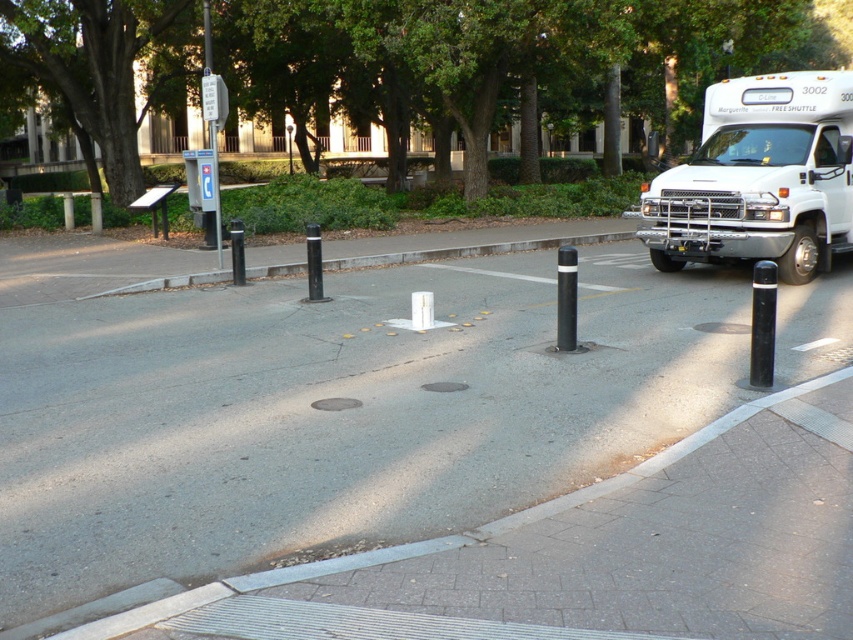
In the scene shown: Is gray asphalt at center taller than black rubber pole at right?

Correct, gray asphalt at center is much taller as black rubber pole at right.

In the scene shown: Is gray asphalt at center smaller than black rubber pole at right?

No, gray asphalt at center is not smaller than black rubber pole at right.

Between point (273, 493) and point (767, 330), which one is positioned behind?

Positioned behind is point (767, 330).

The width and height of the screenshot is (853, 640). Find the location of `gray asphalt at center`. gray asphalt at center is located at coordinates (334, 413).

From the picture: Can you confirm if gray asphalt at center is taller than white concrete curb at center?

Yes, gray asphalt at center is taller than white concrete curb at center.

Who is higher up, gray asphalt at center or white concrete curb at center?

white concrete curb at center

Does point (338, 509) come farther from viewer compared to point (381, 257)?

No.

This screenshot has height=640, width=853. Identify the location of gray asphalt at center. (334, 413).

Can you confirm if black rubber pole at right is smaller than black polished bollard at center?

No.

Does black rubber pole at right have a larger size compared to black polished bollard at center?

Correct, black rubber pole at right is larger in size than black polished bollard at center.

Is point (766, 294) positioned behind point (560, 333)?

No.

The image size is (853, 640). Identify the location of black rubber pole at right. click(762, 323).